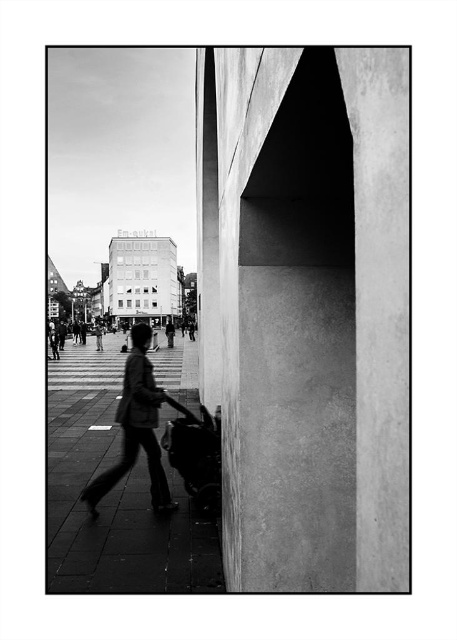
Question: Which of the following is the farthest from the observer?

Choices:
 (A) (148, 372)
 (B) (180, 476)
 (C) (405, 60)

Answer: (B)

Question: From the image, what is the correct spatial relationship of smooth concrete sidewalk at center in relation to metallic smooth baby carriage at center?

Choices:
 (A) left
 (B) right

Answer: (A)

Question: Does smooth concrete pillar at center appear on the left side of metallic smooth baby carriage at center?

Choices:
 (A) yes
 (B) no

Answer: (B)

Question: Which point is closer to the camera?

Choices:
 (A) (317, 307)
 (B) (129, 376)
 (C) (142, 525)

Answer: (A)

Question: Is smooth concrete sidewalk at center to the right of metallic smooth baby carriage at center from the viewer's perspective?

Choices:
 (A) no
 (B) yes

Answer: (A)

Question: Which object is closer to the camera taking this photo?

Choices:
 (A) smooth concrete sidewalk at center
 (B) matte black jacket at center
 (C) metallic smooth baby carriage at center

Answer: (A)